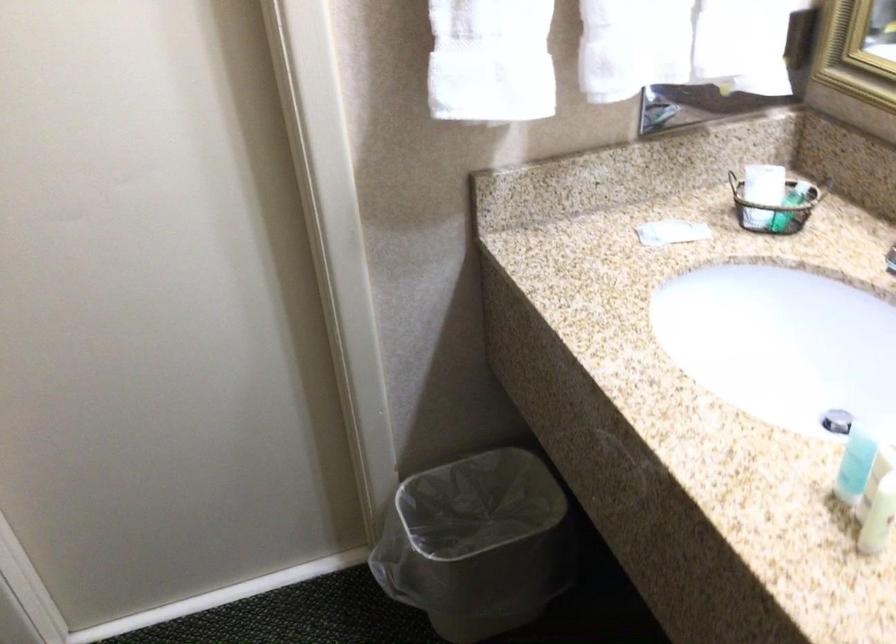
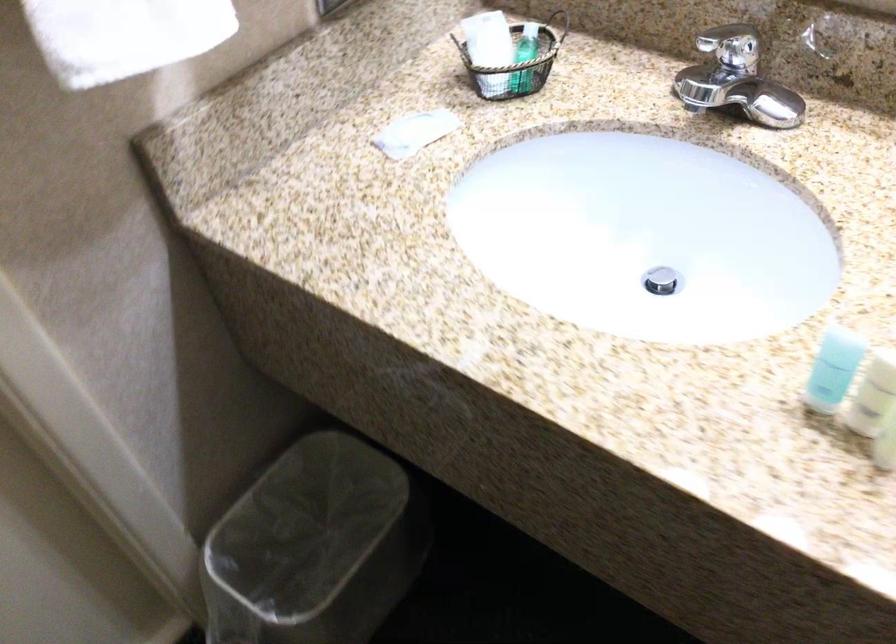
Locate, in the second image, the point that corresponds to pixel 778 202 in the first image.

(524, 59)